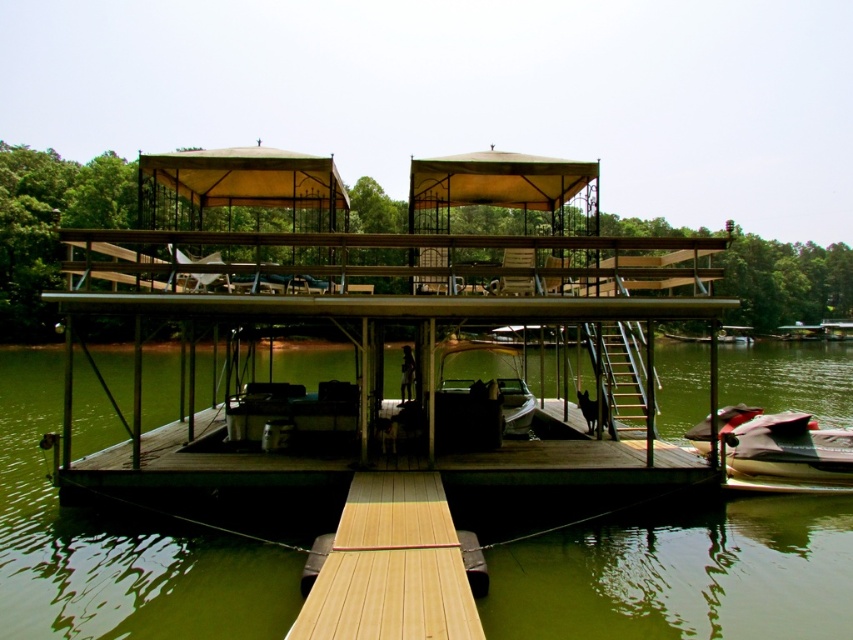
Is light brown wood at center positioned at the back of white rubber jet ski at lower right?

No, it is not.

Who is positioned more to the left, light brown wood at center or white rubber jet ski at lower right?

light brown wood at center is more to the left.

Is point (459, 596) farther from viewer compared to point (851, 464)?

No, it is in front of (851, 464).

Locate an element on the screen. light brown wood at center is located at coordinates (392, 566).

Does point (39, 474) come closer to viewer compared to point (367, 625)?

No, (39, 474) is further to viewer.

Is point (741, 364) positioned behind point (413, 557)?

Yes, it is.

Is point (22, 426) farther from viewer compared to point (409, 554)?

That is True.

In order to click on green water at center in this screenshot , I will do [x=682, y=576].

Is green water at center shorter than white rubber jet ski at lower right?

No, green water at center is not shorter than white rubber jet ski at lower right.

Between green water at center and white rubber jet ski at lower right, which one appears on the left side from the viewer's perspective?

Positioned to the left is green water at center.

Is point (701, 381) behind point (697, 424)?

Yes, it is behind point (697, 424).

Identify the location of green water at center. (682, 576).